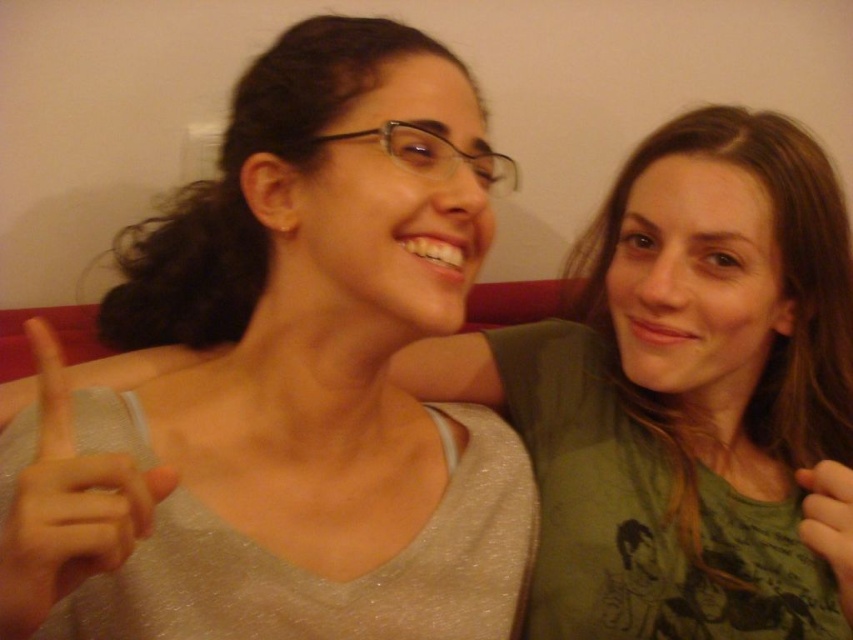
Question: In this image, where is matte gray hand at left located relative to matte green t-shirt at right?

Choices:
 (A) left
 (B) right

Answer: (A)

Question: Where is matte gray hand at left located in relation to matte green t-shirt at right in the image?

Choices:
 (A) right
 (B) left

Answer: (B)

Question: Is matte gray hand at left to the left of matte green t-shirt at right from the viewer's perspective?

Choices:
 (A) yes
 (B) no

Answer: (A)